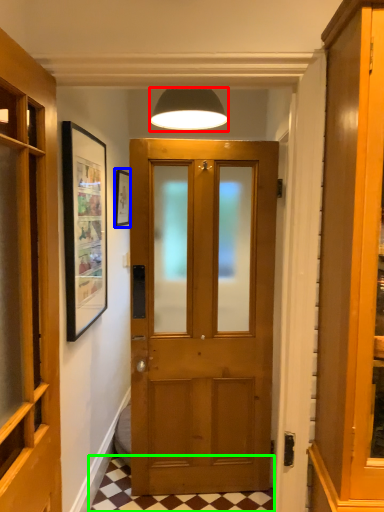
Question: Estimate the real-world distances between objects in this image. Which object is closer to lamp (highlighted by a red box), picture frame (highlighted by a blue box) or tile (highlighted by a green box)?

Choices:
 (A) picture frame
 (B) tile

Answer: (A)